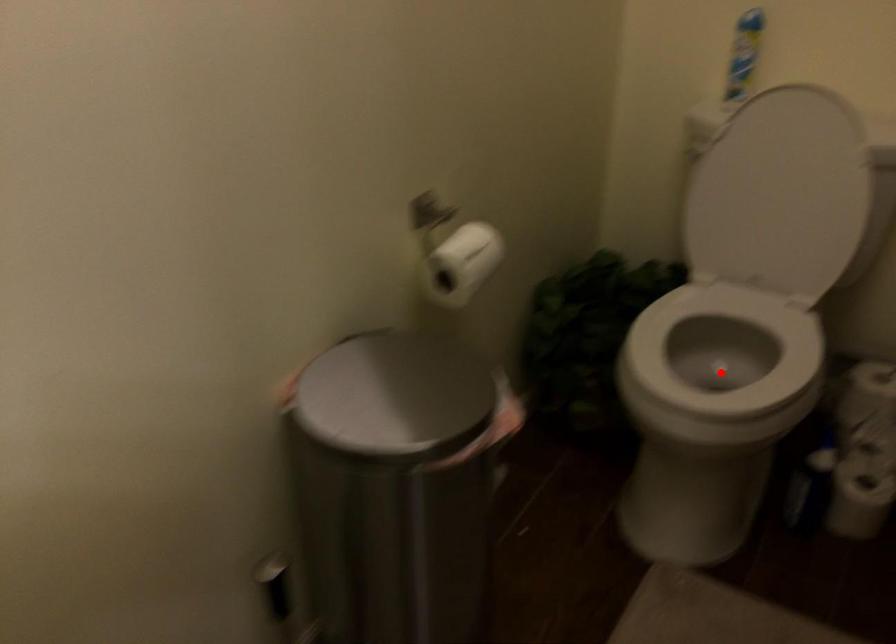
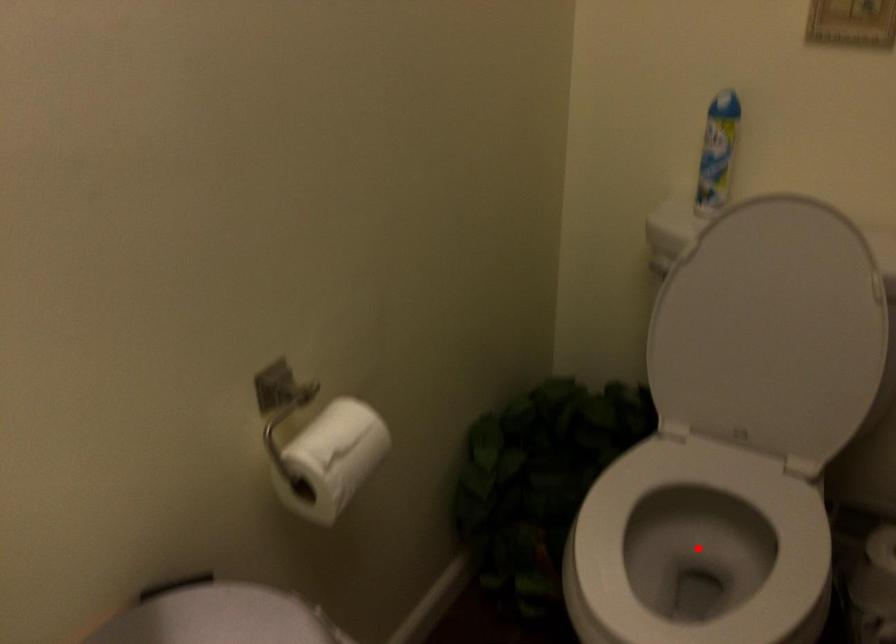
I am providing you with two images of the same scene from different viewpoints. A red point is marked on the first image and another point is marked on the second image. Is the red point in image1 aligned with the point shown in image2?

Yes